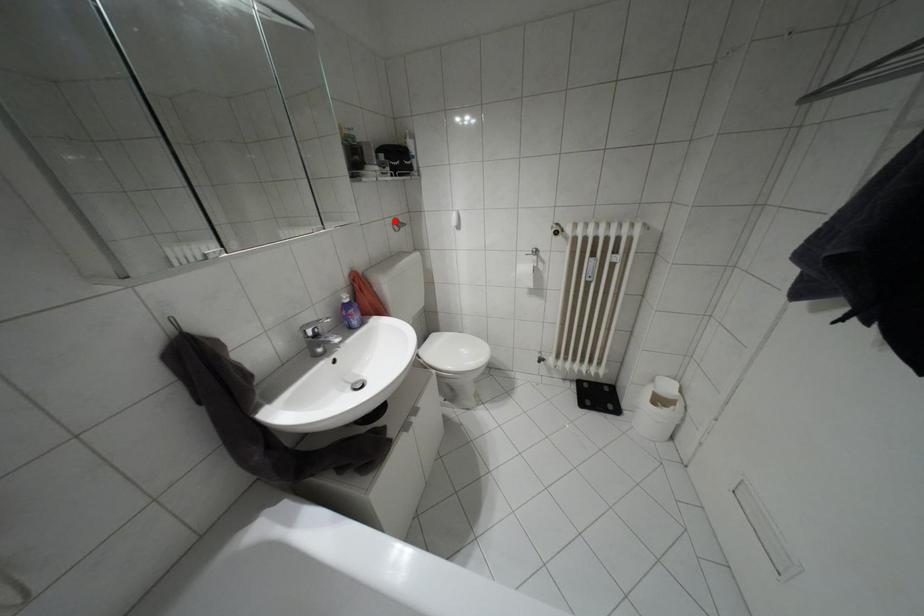
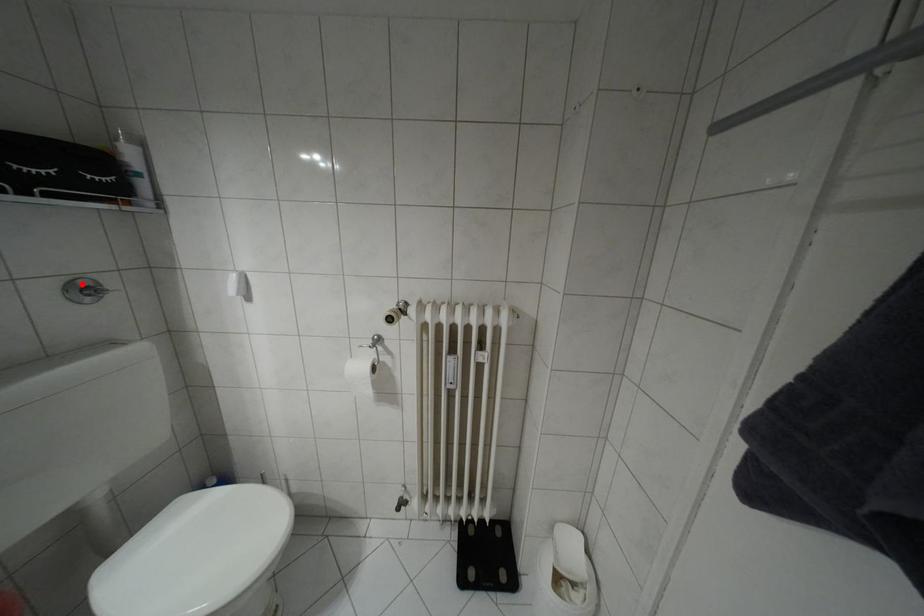
I am providing you with two images of the same scene from different viewpoints. A red point is marked on the first image and another point is marked on the second image. Does the point marked in image1 correspond to the same location as the one in image2?

Yes